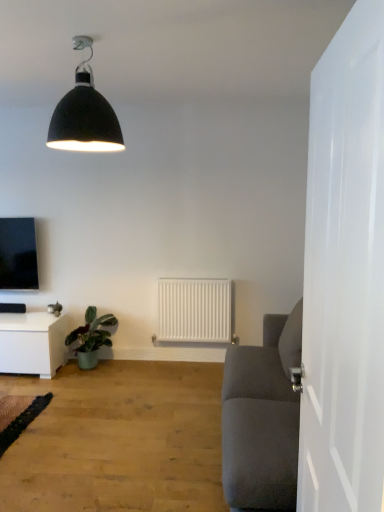
Locate an element on the screen. The height and width of the screenshot is (512, 384). free space below matte black lampshade at upper center (from a real-world perspective) is located at coordinates (83, 463).